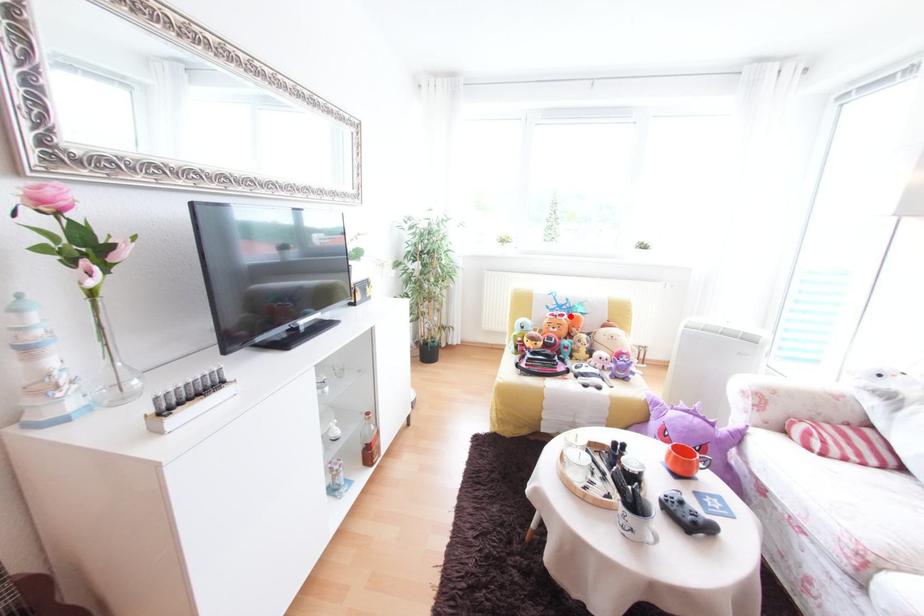
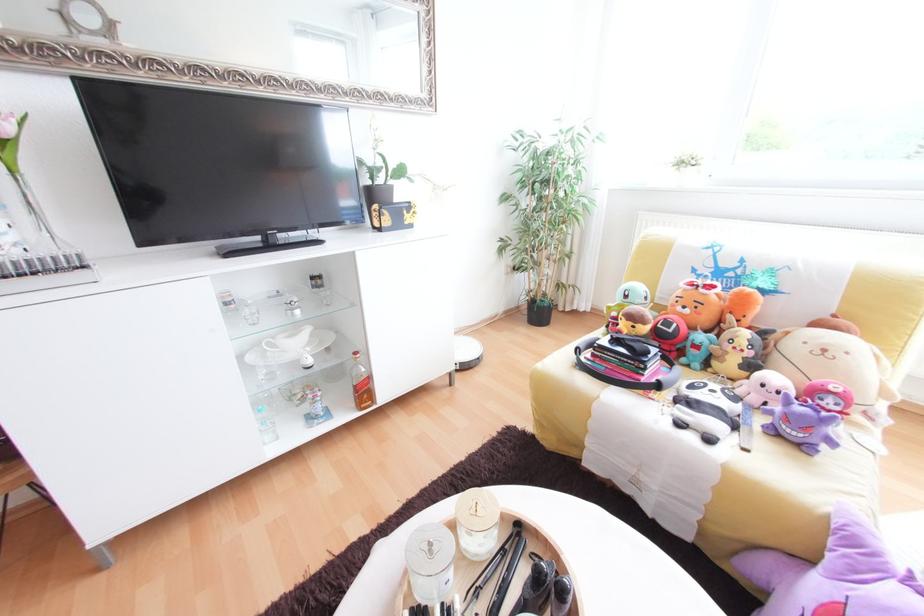
The point at the highlighted location is marked in the first image. Where is the corresponding point in the second image?

(719, 288)